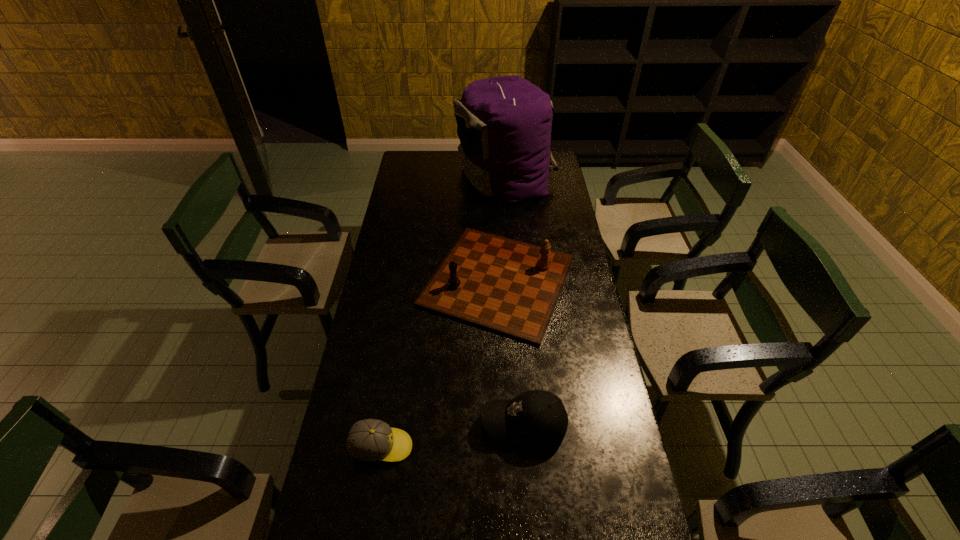
You are a GUI agent. You are given a task and a screenshot of the screen. Output one action in this format:
    pyautogui.click(x=<x>, y=<y>)
    Task: Click on the baseball cap that stands as the second closest to the tallest object
    
    Given the screenshot: What is the action you would take?
    pyautogui.click(x=372, y=440)

Locate which baseball cap is the closest to the gameboard. Please provide its 2D coordinates. Your answer should be formatted as a tuple, i.e. [(x, y)], where the tuple contains the x and y coordinates of a point satisfying the conditions above.

[(537, 418)]

You are a GUI agent. You are given a task and a screenshot of the screen. Output one action in this format:
    pyautogui.click(x=<x>, y=<y>)
    Task: Click on the vacant space that satisfies the following two spatial constraints: 1. on the front side of the gameboard; 2. on the front-facing side of the shortest object
    The image size is (960, 540).
    Given the screenshot: What is the action you would take?
    pyautogui.click(x=506, y=447)